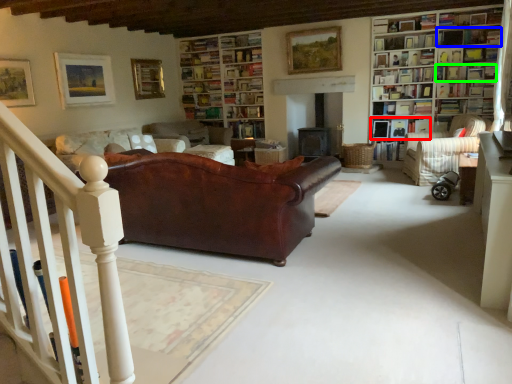
Question: Considering the real-world distances, which object is farthest from book (highlighted by a red box)? shelf (highlighted by a blue box) or book (highlighted by a green box)?

Choices:
 (A) shelf
 (B) book

Answer: (A)